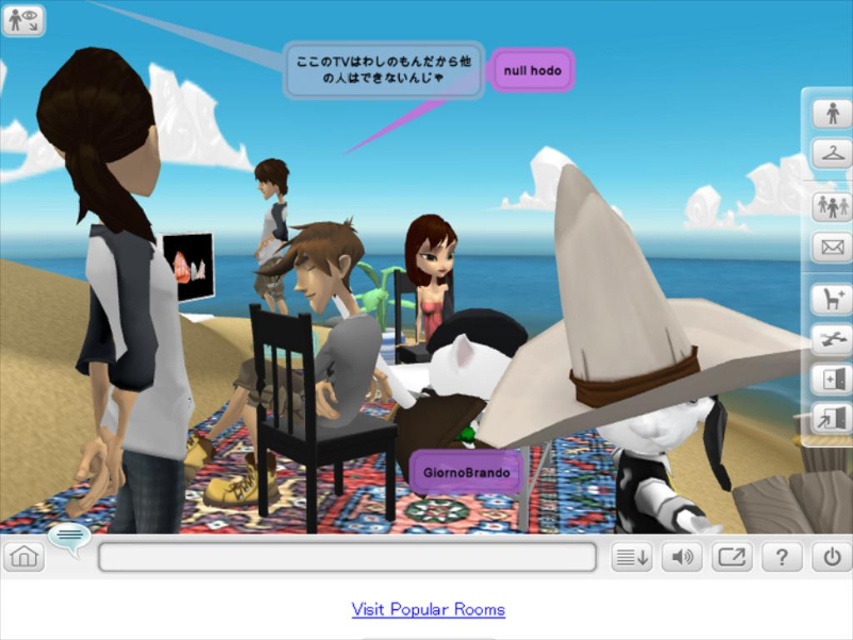
You are an avatar in the beach scene. You need to decide which clothing item to wear for a photo. The white matte dress at left and the matte gray shirt at center are options. Based on their sizes, which one would look better in a photo if you want to appear taller?

The matte gray shirt at center is taller than the white matte dress at left, so wearing the matte gray shirt at center would make you appear taller in the photo.

Based on the scene description, where is the white matte dress at left located in terms of its 2D coordinates?

The white matte dress at left is located at the 2D coordinates of point (122, 291).